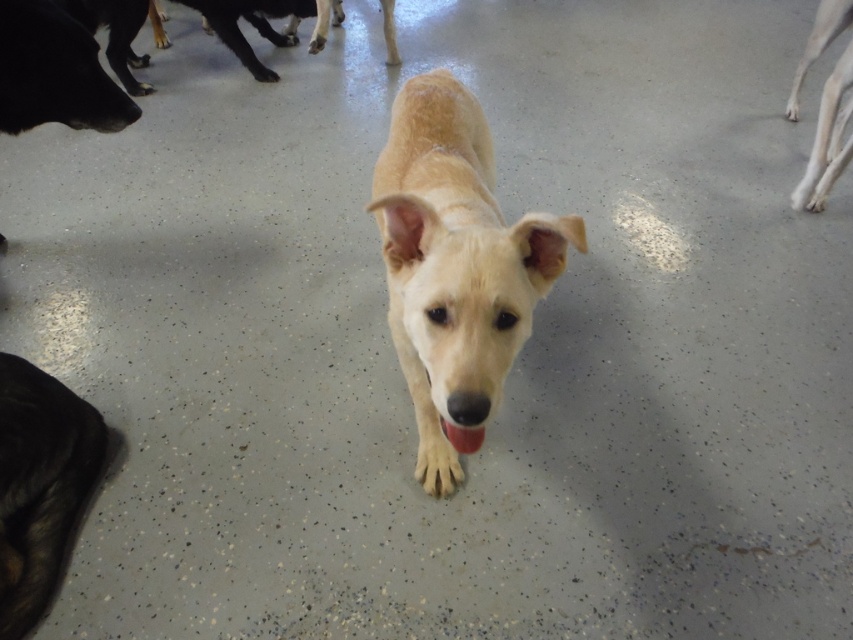
Question: Which object is farther from the camera taking this photo?

Choices:
 (A) shiny black fur at lower left
 (B) light brown fur at center
 (C) shiny black dog at left

Answer: (C)

Question: Does shiny black fur at lower left have a smaller size compared to pink glossy tongue at center?

Choices:
 (A) no
 (B) yes

Answer: (A)

Question: Which point appears closest to the camera in this image?

Choices:
 (A) (468, 452)
 (B) (71, 56)
 (C) (819, 28)

Answer: (A)

Question: Is shiny black dog at left bigger than pink glossy tongue at center?

Choices:
 (A) yes
 (B) no

Answer: (A)

Question: Which point is closer to the camera?

Choices:
 (A) (476, 440)
 (B) (802, 67)

Answer: (A)

Question: From the image, what is the correct spatial relationship of light brown fur at center in relation to pink glossy tongue at center?

Choices:
 (A) below
 (B) above

Answer: (B)